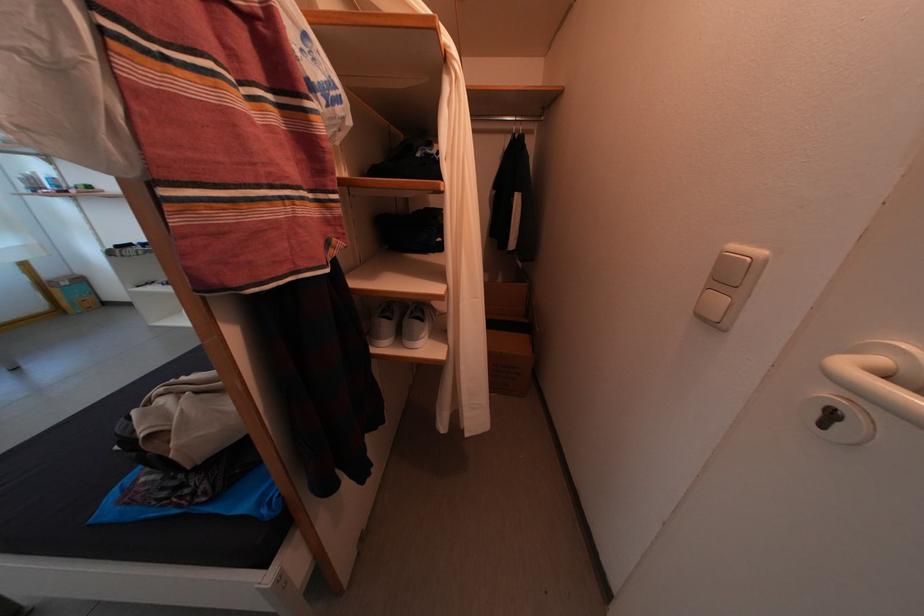
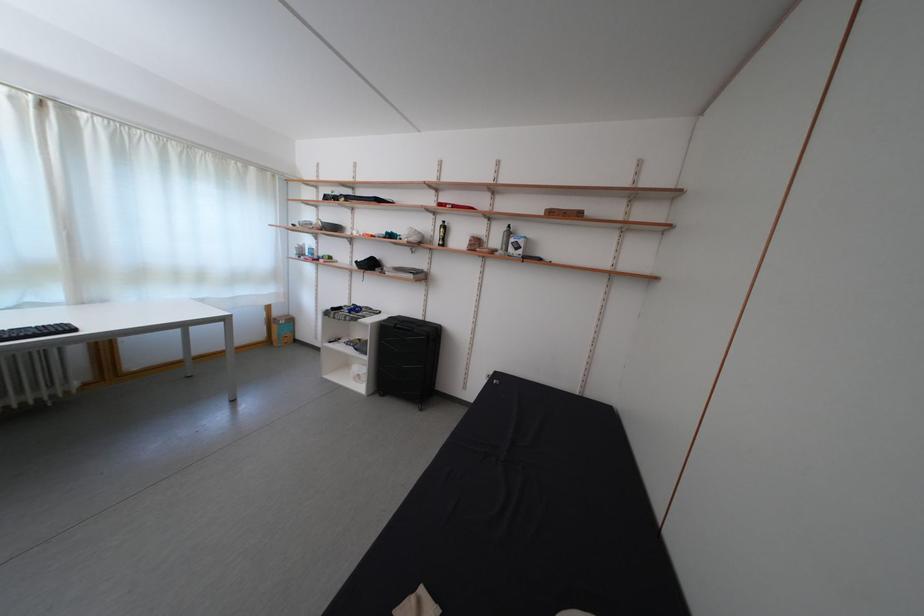
Where in the second image is the point corresponding to (x=55, y=281) from the first image?

(285, 320)